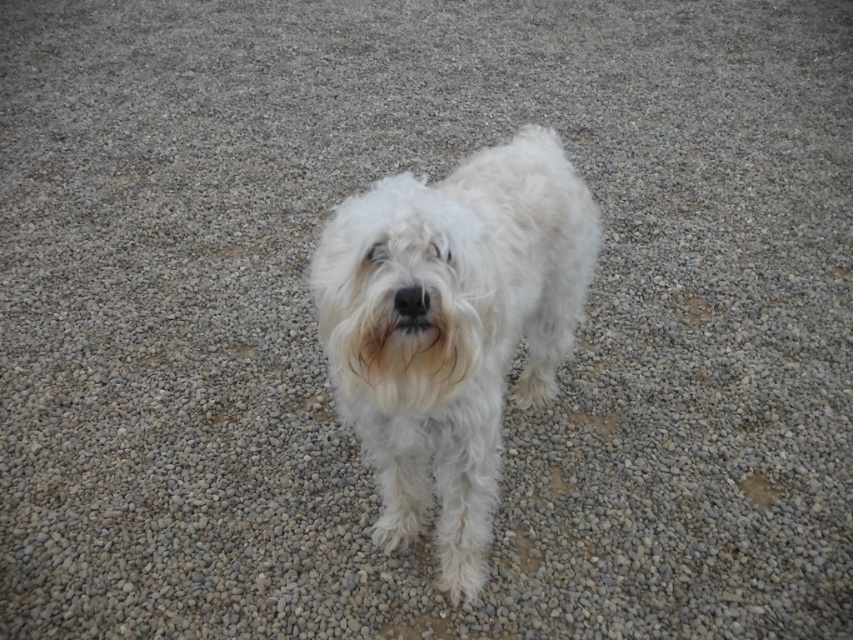
You are a photographer trying to capture the white fluffy dog at center in the image. The camera is at the origin point. You want to focus on the point at coordinates point (451, 328). Is this point on the dog?

Yes, the point (451, 328) is on the white fluffy dog at center, so focusing there will capture the dog effectively.

You are a photographer trying to capture the white fluffy dog at center and the black fur at center in a single shot. Given that the camera can only focus on objects within a certain height range, which one is more likely to be in focus if the camera is set to focus on taller objects?

The white fluffy dog at center is much taller than the black fur at center, so it is more likely to be in focus if the camera is set to focus on taller objects.